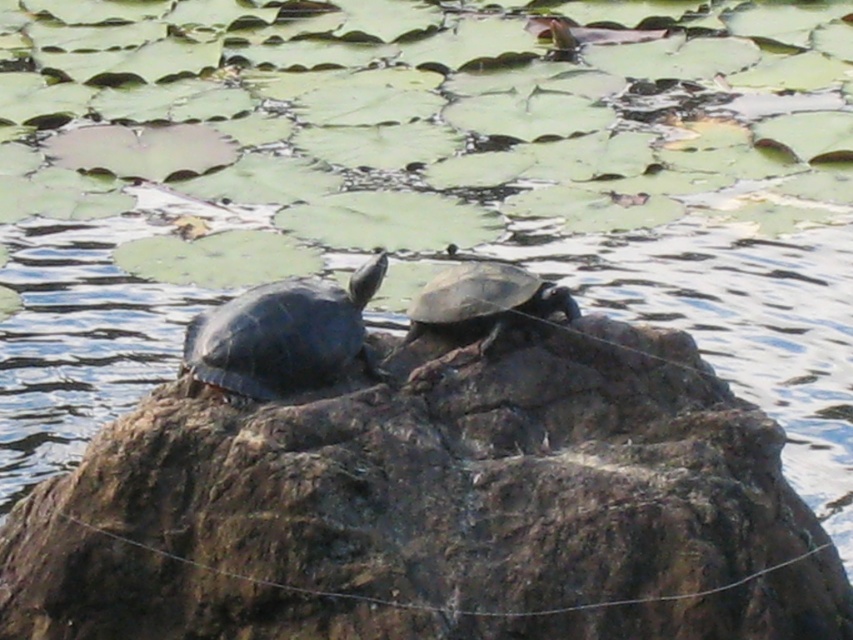
You are a photographer aiming to capture a closeup of the shiny black tortoise at center without including the brown rough rock at center in the frame. Given their positions, is this possible?

The brown rough rock at center is to the right of the shiny black tortoise at center. Since the rock is positioned to the right of the tortoise, you can adjust your camera angle to focus solely on the shiny black tortoise at center while excluding the brown rough rock at center from the shot.

You are a photographer trying to capture both the shiny black tortoise at center and the shiny brown tortoise at center in a single frame. Based on their positions, which tortoise should you focus on first to ensure both are in the shot?

The shiny black tortoise at center is positioned on the left side of the shiny brown tortoise at center, so focusing on the shiny brown tortoise at center first would allow you to frame both in the shot since the shiny black tortoise at center is to its left.

You are a small frog trying to jump from the lily pads to the brown rough rock at center to reach the shiny brown tortoise at center. Can you safely land on the rock without falling into the water?

The brown rough rock at center is bigger than the shiny brown tortoise at center, so there is enough space for the frog to land safely on the rock and reach the shiny brown tortoise at center.